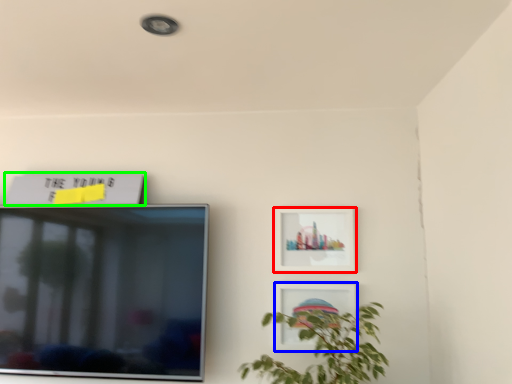
Question: Estimate the real-world distances between objects in this image. Which object is closer to picture frame (highlighted by a red box), picture frame (highlighted by a blue box) or picture frame (highlighted by a green box)?

Choices:
 (A) picture frame
 (B) picture frame

Answer: (A)